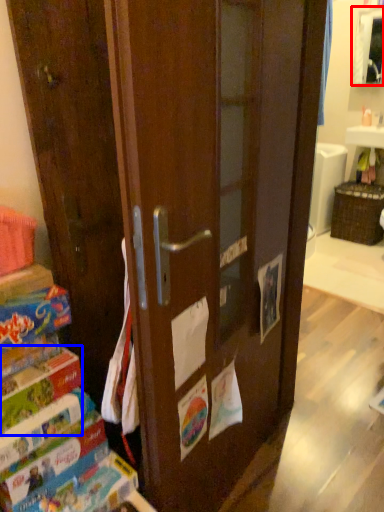
Question: Which object appears closest to the camera in this image, cabinetry (highlighted by a red box) or paperback book (highlighted by a blue box)?

Choices:
 (A) cabinetry
 (B) paperback book

Answer: (B)